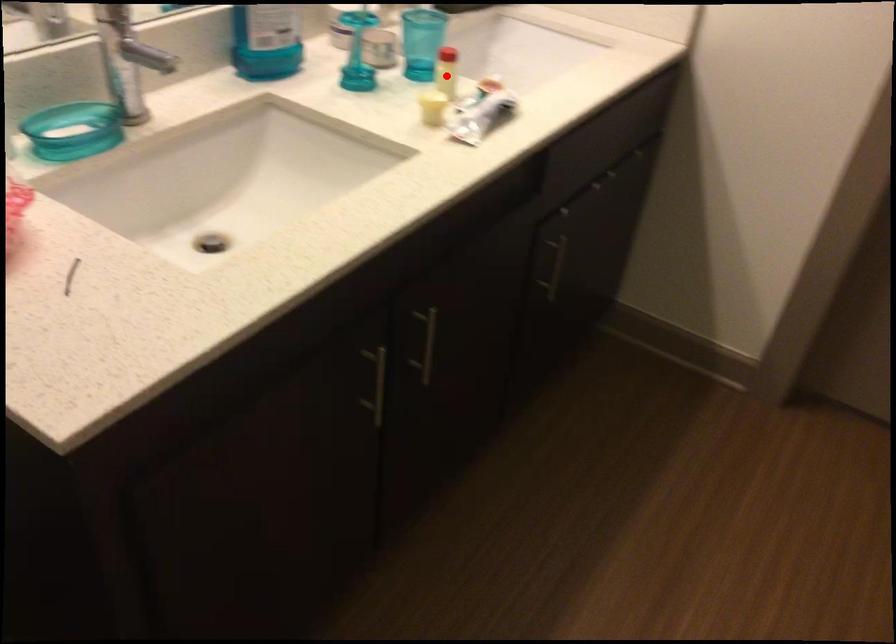
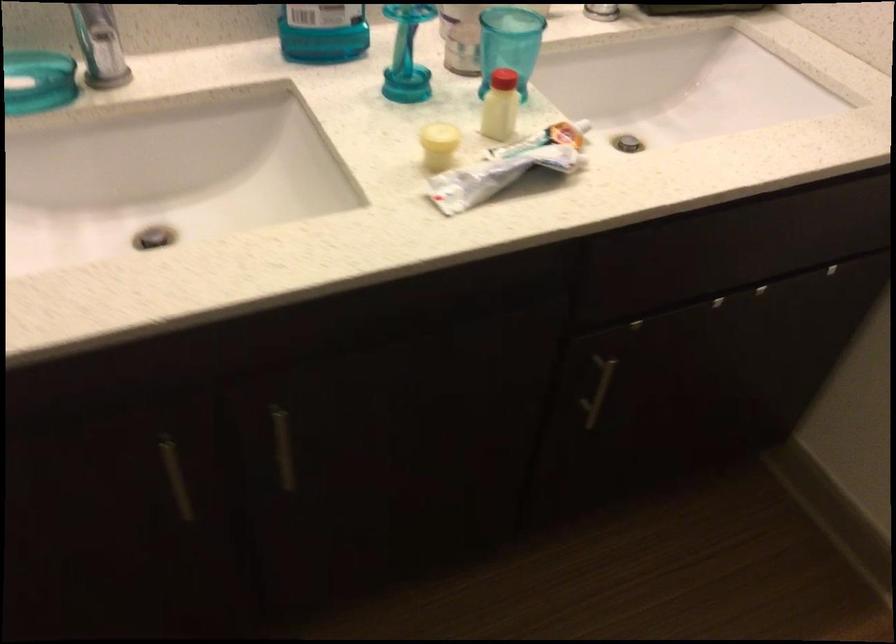
Find the pixel in the second image that matches the highlighted location in the first image.

(501, 106)